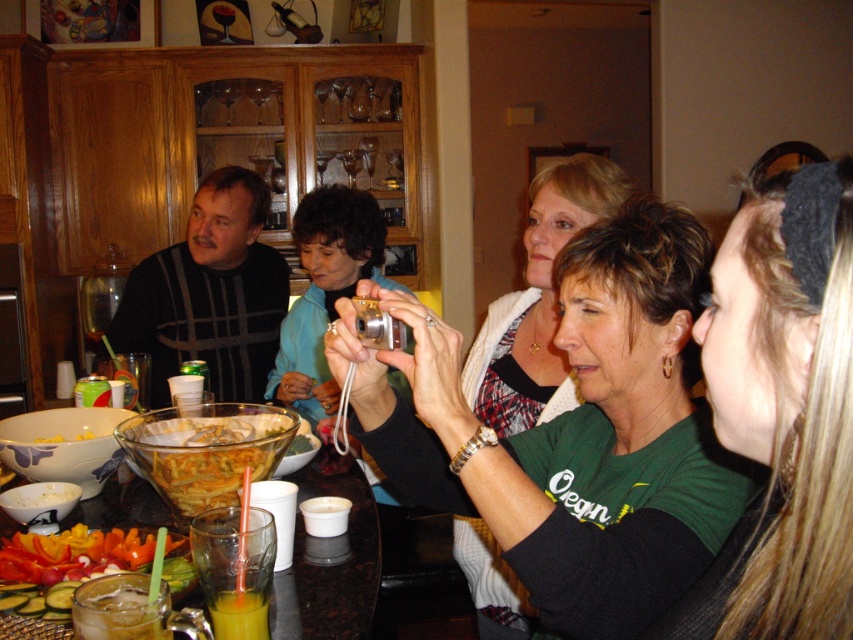
Is yellow crispy chips at center above vibrant sliced vegetables at lower left?

Yes, yellow crispy chips at center is above vibrant sliced vegetables at lower left.

You are a GUI agent. You are given a task and a screenshot of the screen. Output one action in this format:
    pyautogui.click(x=<x>, y=<y>)
    Task: Click on the yellow crispy chips at center
    This screenshot has width=853, height=640.
    Given the screenshot: What is the action you would take?
    pyautogui.click(x=206, y=451)

Consider the image. Is dark green fabric headband at upper right shorter than vibrant sliced vegetables at lower left?

No.

Between dark green fabric headband at upper right and vibrant sliced vegetables at lower left, which one has less height?

Standing shorter between the two is vibrant sliced vegetables at lower left.

What do you see at coordinates (782, 412) in the screenshot? This screenshot has height=640, width=853. I see `dark green fabric headband at upper right` at bounding box center [782, 412].

In order to click on dark green fabric headband at upper right in this screenshot , I will do `click(782, 412)`.

Who is more forward, (134, 637) or (267, 596)?

Point (134, 637) is more forward.

Who is positioned more to the left, ice clear glass at lower left or translucent glass cup at lower left?

ice clear glass at lower left

Is point (91, 600) positioned before point (254, 632)?

Yes.

Image resolution: width=853 pixels, height=640 pixels. I want to click on ice clear glass at lower left, so click(120, 609).